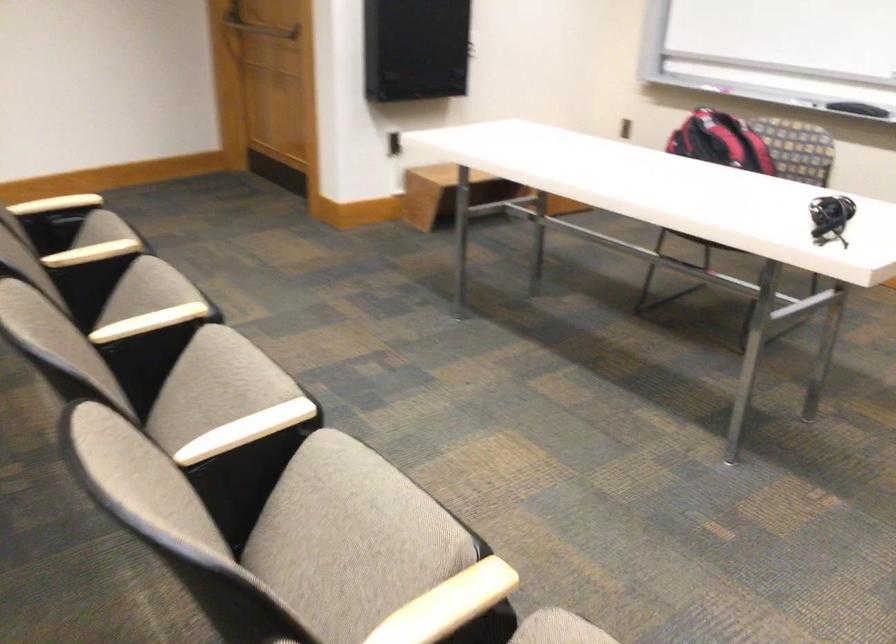
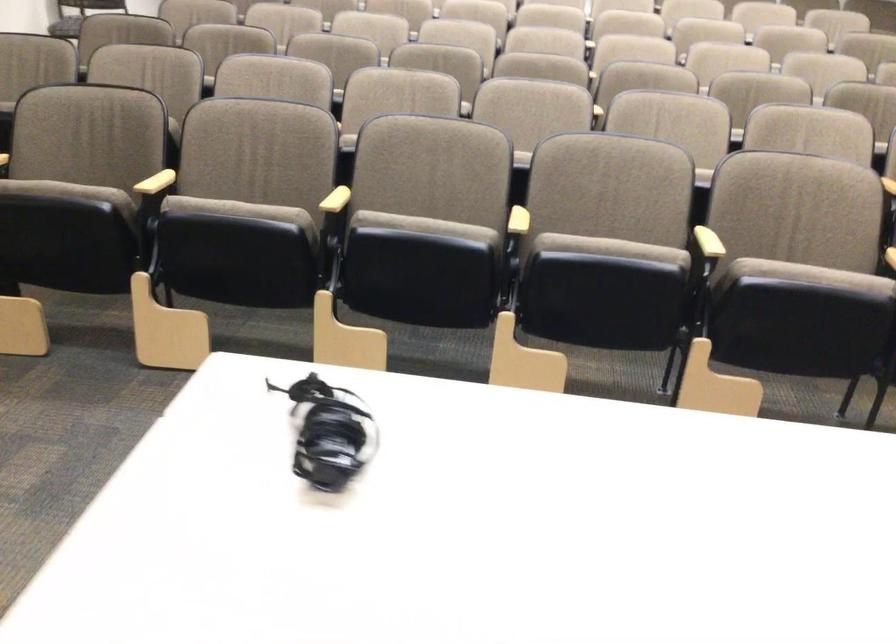
In the second image, find the point that corresponds to the point at 250,426 in the first image.

(518, 221)